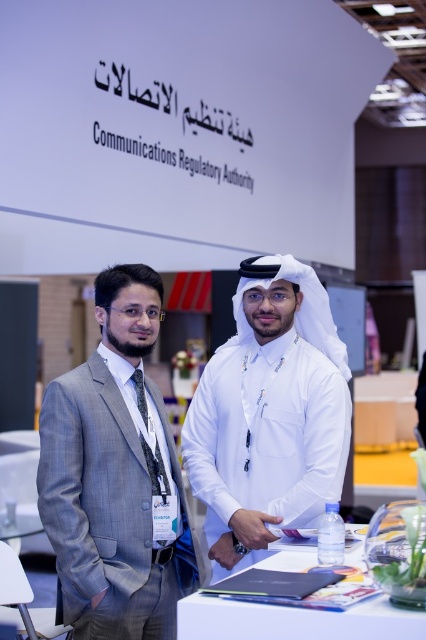
Question: Is gray suit at left positioned before white matte shirt at center?

Choices:
 (A) no
 (B) yes

Answer: (B)

Question: Among these objects, which one is nearest to the camera?

Choices:
 (A) gray suit at left
 (B) white matte shirt at center

Answer: (A)

Question: Is gray suit at left closer to camera compared to white matte shirt at center?

Choices:
 (A) no
 (B) yes

Answer: (B)

Question: Is gray suit at left above white matte shirt at center?

Choices:
 (A) no
 (B) yes

Answer: (A)

Question: Which of the following is the farthest from the observer?

Choices:
 (A) (199, 445)
 (B) (187, 570)

Answer: (A)

Question: Which point is farther to the camera?

Choices:
 (A) white matte shirt at center
 (B) gray suit at left

Answer: (A)